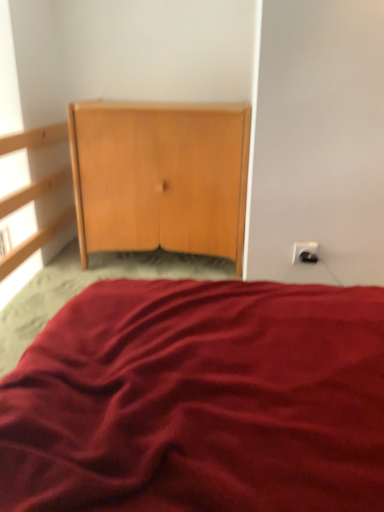
Describe the element at coordinates (161, 177) in the screenshot. The width and height of the screenshot is (384, 512). I see `light wood/texture cupboard at center` at that location.

Identify the location of light wood/texture cupboard at center. The height and width of the screenshot is (512, 384). (161, 177).

Find the location of a particular element. Image resolution: width=384 pixels, height=512 pixels. white plastic electric outlet at right is located at coordinates (305, 252).

The width and height of the screenshot is (384, 512). What do you see at coordinates (305, 252) in the screenshot? I see `white plastic electric outlet at right` at bounding box center [305, 252].

Image resolution: width=384 pixels, height=512 pixels. Identify the location of light wood/texture cupboard at center. [x=161, y=177].

Which object is positioned more to the left, white plastic electric outlet at right or light wood/texture cupboard at center?

light wood/texture cupboard at center is more to the left.

Which object is more forward, white plastic electric outlet at right or light wood/texture cupboard at center?

white plastic electric outlet at right is in front.

Considering the points (299, 246) and (215, 248), which point is behind, point (299, 246) or point (215, 248)?

The point (215, 248) is farther.

From the image's perspective, which one is positioned higher, white plastic electric outlet at right or light wood/texture cupboard at center?

From the image's view, light wood/texture cupboard at center is above.

From a real-world perspective, between white plastic electric outlet at right and light wood/texture cupboard at center, who is vertically higher?

In real-world perspective, light wood/texture cupboard at center is above.

Which of these two, white plastic electric outlet at right or light wood/texture cupboard at center, is wider?

light wood/texture cupboard at center.

Is white plastic electric outlet at right taller than light wood/texture cupboard at center?

No.

Considering the sizes of white plastic electric outlet at right and light wood/texture cupboard at center in the image, is white plastic electric outlet at right bigger or smaller than light wood/texture cupboard at center?

white plastic electric outlet at right is smaller than light wood/texture cupboard at center.

Is white plastic electric outlet at right located outside light wood/texture cupboard at center?

That's correct, white plastic electric outlet at right is outside of light wood/texture cupboard at center.

Is white plastic electric outlet at right far from light wood/texture cupboard at center?

white plastic electric outlet at right is near light wood/texture cupboard at center, not far away.

Consider the image. Is white plastic electric outlet at right looking in the opposite direction of light wood/texture cupboard at center?

No, white plastic electric outlet at right's orientation is not away from light wood/texture cupboard at center.

Identify the location of cupboard above the white plastic electric outlet at right (from the image's perspective). (161, 177).

Visually, is light wood/texture cupboard at center positioned to the left or to the right of white plastic electric outlet at right?

light wood/texture cupboard at center is positioned on white plastic electric outlet at right's left side.

Which object is closer to the camera taking this photo, light wood/texture cupboard at center or white plastic electric outlet at right?

white plastic electric outlet at right is closer to the camera.

Is point (78, 180) positioned behind point (306, 242)?

Yes, it is behind point (306, 242).

In the scene shown: From the image's perspective, between light wood/texture cupboard at center and white plastic electric outlet at right, who is located below?

From the image's view, white plastic electric outlet at right is below.

From a real-world perspective, between light wood/texture cupboard at center and white plastic electric outlet at right, who is vertically higher?

light wood/texture cupboard at center is physically above.

Considering the sizes of objects light wood/texture cupboard at center and white plastic electric outlet at right in the image provided, who is thinner, light wood/texture cupboard at center or white plastic electric outlet at right?

white plastic electric outlet at right is thinner.

Considering the relative sizes of light wood/texture cupboard at center and white plastic electric outlet at right in the image provided, is light wood/texture cupboard at center shorter than white plastic electric outlet at right?

Incorrect, the height of light wood/texture cupboard at center does not fall short of that of white plastic electric outlet at right.

Considering the relative sizes of light wood/texture cupboard at center and white plastic electric outlet at right in the image provided, is light wood/texture cupboard at center bigger than white plastic electric outlet at right?

Correct, light wood/texture cupboard at center is larger in size than white plastic electric outlet at right.

Do you think light wood/texture cupboard at center is within white plastic electric outlet at right, or outside of it?

light wood/texture cupboard at center is outside white plastic electric outlet at right.

Are light wood/texture cupboard at center and white plastic electric outlet at right beside each other?

No.

Is white plastic electric outlet at right at the back of light wood/texture cupboard at center?

That's not correct — light wood/texture cupboard at center is not looking away from white plastic electric outlet at right.

Can you tell me how much light wood/texture cupboard at center and white plastic electric outlet at right differ in facing direction?

The facing directions of light wood/texture cupboard at center and white plastic electric outlet at right are 0.00577 degrees apart.

The width and height of the screenshot is (384, 512). In order to click on electric outlet in front of the light wood/texture cupboard at center in this screenshot , I will do `click(305, 252)`.

At what (x,y) coordinates should I click in order to perform the action: click on electric outlet below the light wood/texture cupboard at center (from a real-world perspective). Please return your answer as a coordinate pair (x, y). Looking at the image, I should click on (305, 252).

Locate an element on the screen. cupboard above the white plastic electric outlet at right (from a real-world perspective) is located at coordinates (161, 177).